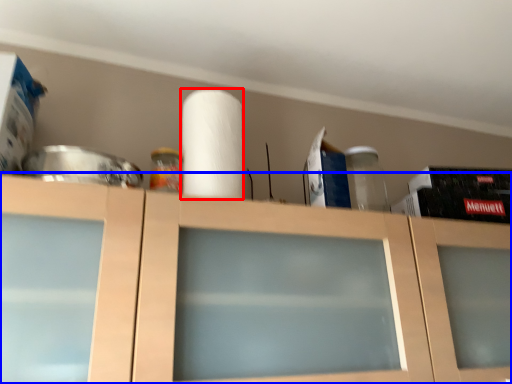
Question: Which object appears farthest to the camera in this image, paper towel (highlighted by a red box) or cabinetry (highlighted by a blue box)?

Choices:
 (A) paper towel
 (B) cabinetry

Answer: (A)